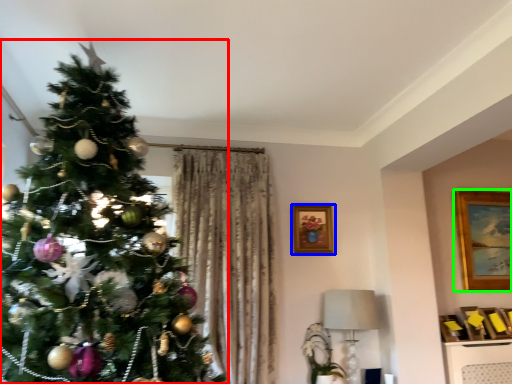
Question: Estimate the real-world distances between objects in this image. Which object is farther from christmas tree (highlighted by a red box), picture frame (highlighted by a blue box) or picture frame (highlighted by a green box)?

Choices:
 (A) picture frame
 (B) picture frame

Answer: (B)